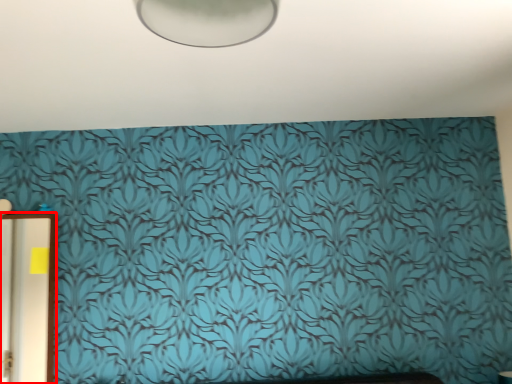
Question: From the image's perspective, what is the correct spatial relationship of door (annotated by the red box) in relation to backdrop?

Choices:
 (A) below
 (B) above

Answer: (A)